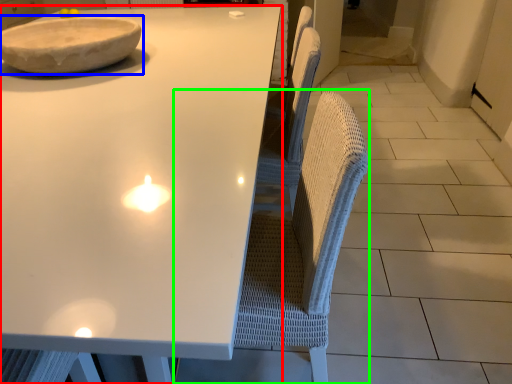
Question: Based on their relative distances, which object is nearer to table (highlighted by a red box)? Choose from bowl (highlighted by a blue box) and swivel chair (highlighted by a green box).

Choices:
 (A) bowl
 (B) swivel chair

Answer: (A)